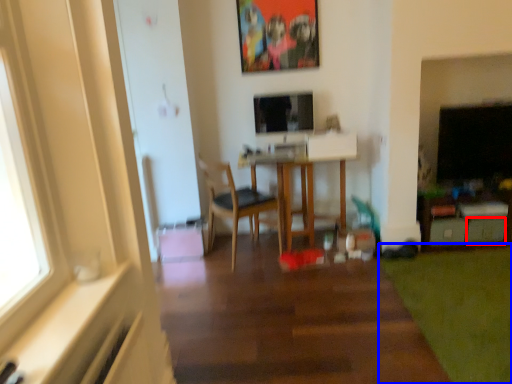
Question: Which of the following is the farthest to the observer, drawer (highlighted by a red box) or grass (highlighted by a blue box)?

Choices:
 (A) drawer
 (B) grass

Answer: (A)